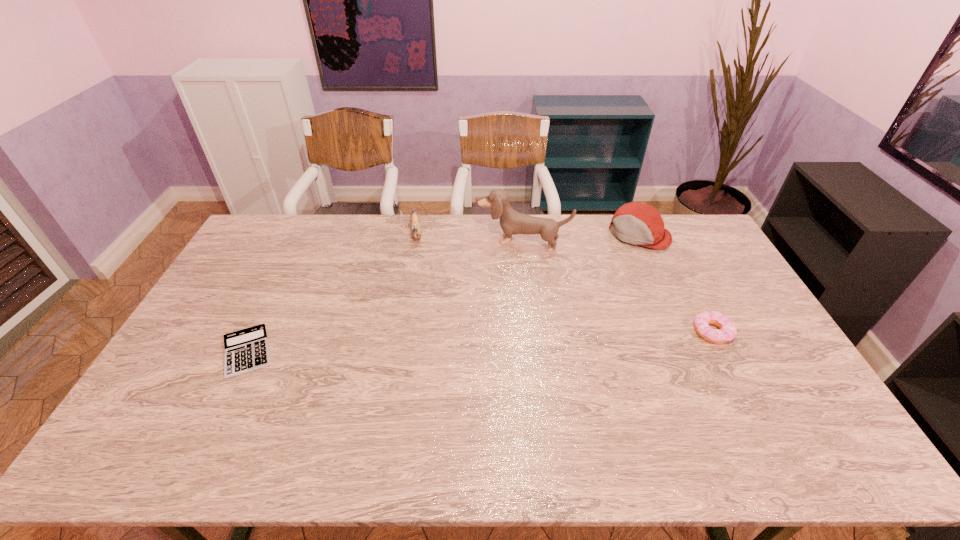
Image resolution: width=960 pixels, height=540 pixels. In order to click on free region located 0.280m at the face of the third object from right to left in this screenshot , I will do `click(490, 305)`.

Image resolution: width=960 pixels, height=540 pixels. I want to click on free location located at the face of the third object from right to left, so click(480, 332).

Where is `free space located on the front-facing side of the cap`? free space located on the front-facing side of the cap is located at coordinates (596, 285).

Where is `vacant space located on the front-facing side of the cap`? vacant space located on the front-facing side of the cap is located at coordinates (576, 308).

The height and width of the screenshot is (540, 960). Identify the location of blank space located on the front-facing side of the cap. (615, 262).

The width and height of the screenshot is (960, 540). I want to click on free space located on the peel of the second object from left to right, so click(x=419, y=285).

Image resolution: width=960 pixels, height=540 pixels. In order to click on free space located 0.130m on the peel of the second object from left to right in this screenshot , I will do `click(417, 269)`.

This screenshot has height=540, width=960. I want to click on vacant space located on the peel of the second object from left to right, so click(x=421, y=326).

This screenshot has height=540, width=960. What are the coordinates of `puppy that is positioned at the far edge` in the screenshot? It's located at (512, 222).

Locate an element on the screen. cap that is at the far edge is located at coordinates (636, 223).